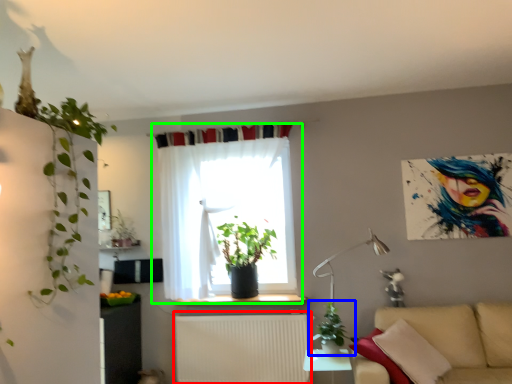
Question: Considering the real-world distances, which object is closest to radiator (highlighted by a red box)? houseplant (highlighted by a blue box) or curtain (highlighted by a green box).

Choices:
 (A) houseplant
 (B) curtain

Answer: (B)